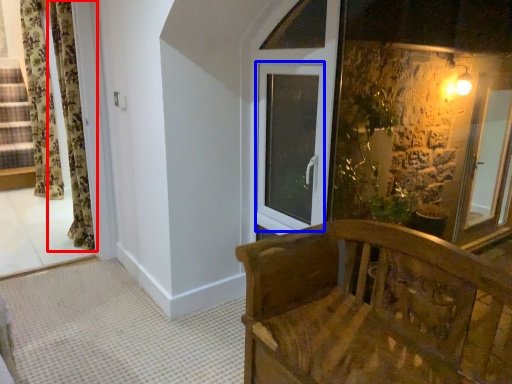
Question: Which object appears farthest to the camera in this image, curtain (highlighted by a red box) or window (highlighted by a blue box)?

Choices:
 (A) curtain
 (B) window

Answer: (A)